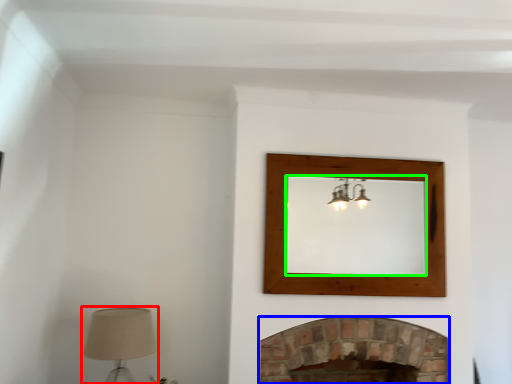
Question: Which object is the farthest from table lamp (highlighted by a red box)? Choose among these: fireplace (highlighted by a blue box) or mirror (highlighted by a green box).

Choices:
 (A) fireplace
 (B) mirror

Answer: (B)